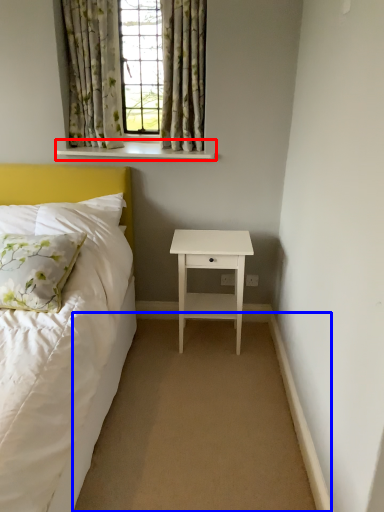
Question: Which object is closer to the camera taking this photo, window sill (highlighted by a red box) or plain (highlighted by a blue box)?

Choices:
 (A) window sill
 (B) plain

Answer: (B)